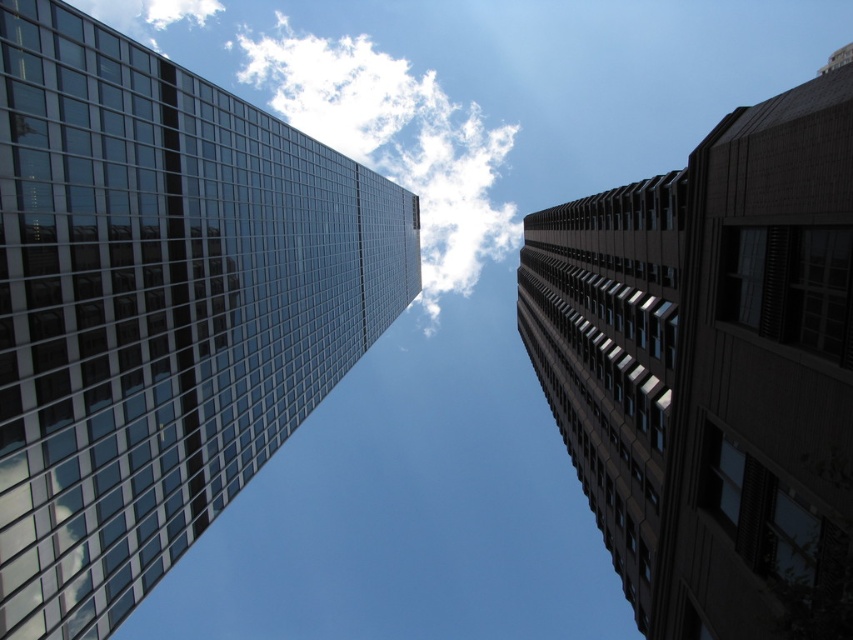
Question: Is glassy reflective skyscraper at left to the left of brown brick building at upper right from the viewer's perspective?

Choices:
 (A) yes
 (B) no

Answer: (A)

Question: Which point is closer to the camera taking this photo?

Choices:
 (A) (283, 60)
 (B) (822, 464)

Answer: (B)

Question: Which point is farther to the camera?

Choices:
 (A) white fluffy cloud at upper center
 (B) glassy reflective skyscraper at left

Answer: (A)

Question: Which point is farther to the camera?

Choices:
 (A) (79, 196)
 (B) (833, 120)

Answer: (A)

Question: Is glassy reflective skyscraper at left to the right of brown brick building at upper right from the viewer's perspective?

Choices:
 (A) no
 (B) yes

Answer: (A)

Question: Is glassy reflective skyscraper at left to the left of brown brick building at upper right from the viewer's perspective?

Choices:
 (A) no
 (B) yes

Answer: (B)